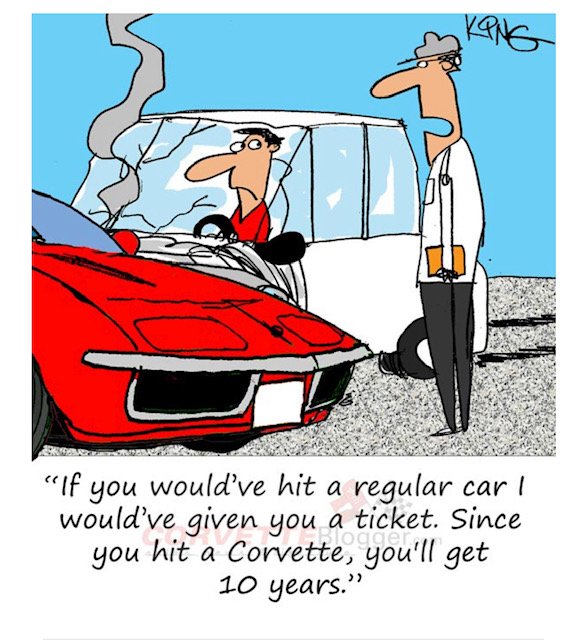
The width and height of the screenshot is (587, 640). In order to click on window in this screenshot , I will do `click(329, 196)`.